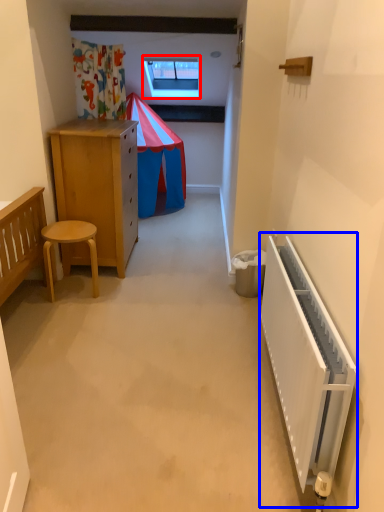
Question: Which of the following is the closest to the observer, window (highlighted by a red box) or radiator (highlighted by a blue box)?

Choices:
 (A) window
 (B) radiator

Answer: (B)